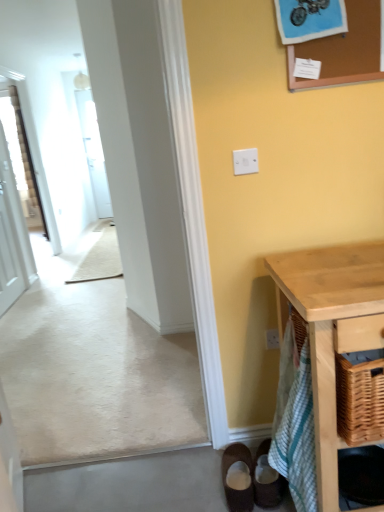
Question: Is light wood table at lower right wider than green striped cloth at lower right?

Choices:
 (A) yes
 (B) no

Answer: (A)

Question: Is green striped cloth at lower right at the back of light wood table at lower right?

Choices:
 (A) yes
 (B) no

Answer: (B)

Question: Does light wood table at lower right turn towards green striped cloth at lower right?

Choices:
 (A) yes
 (B) no

Answer: (B)

Question: Does light wood table at lower right have a smaller size compared to green striped cloth at lower right?

Choices:
 (A) no
 (B) yes

Answer: (A)

Question: Is light wood table at lower right taller than green striped cloth at lower right?

Choices:
 (A) yes
 (B) no

Answer: (A)

Question: Is light wood table at lower right beside green striped cloth at lower right?

Choices:
 (A) no
 (B) yes

Answer: (A)

Question: Is green striped cloth at lower right oriented towards white plastic light switch at center?

Choices:
 (A) yes
 (B) no

Answer: (B)

Question: Is green striped cloth at lower right further to the viewer compared to white plastic light switch at center?

Choices:
 (A) no
 (B) yes

Answer: (A)

Question: Is green striped cloth at lower right to the right of white plastic light switch at center from the viewer's perspective?

Choices:
 (A) yes
 (B) no

Answer: (A)

Question: Is green striped cloth at lower right facing away from white plastic light switch at center?

Choices:
 (A) no
 (B) yes

Answer: (A)

Question: From a real-world perspective, is green striped cloth at lower right on top of white plastic light switch at center?

Choices:
 (A) no
 (B) yes

Answer: (A)

Question: From the image's perspective, is green striped cloth at lower right under white plastic light switch at center?

Choices:
 (A) yes
 (B) no

Answer: (A)

Question: Is corkboard at upper right positioned in front of light wood table at lower right?

Choices:
 (A) yes
 (B) no

Answer: (B)